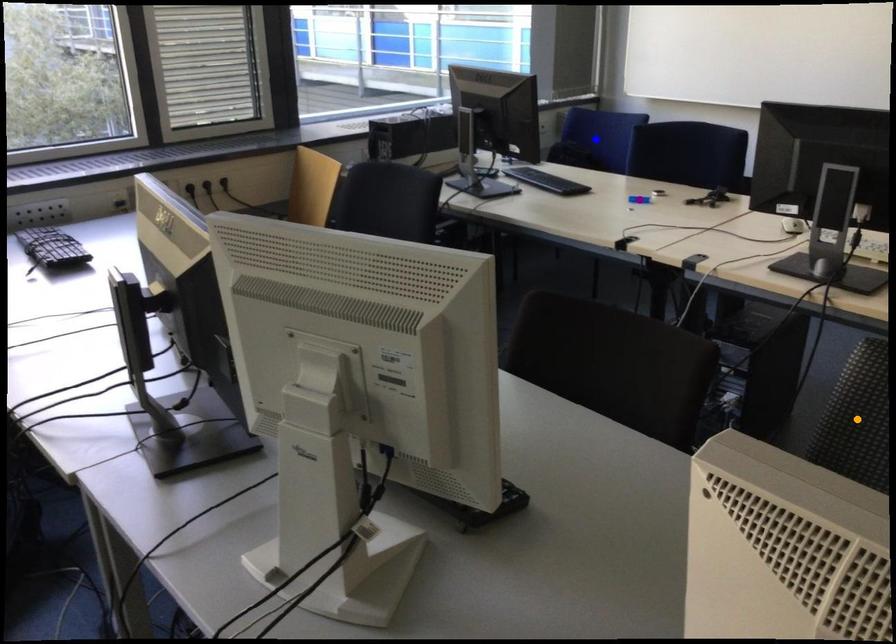
Order these from nearest to farthest:
orange point | blue point | purple point

orange point → purple point → blue point